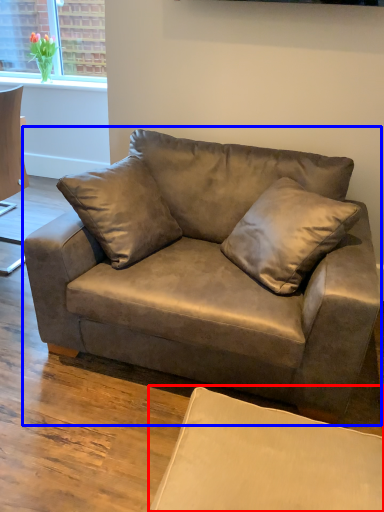
Question: Which object appears closest to the camera in this image, swivel chair (highlighted by a red box) or studio couch (highlighted by a blue box)?

Choices:
 (A) swivel chair
 (B) studio couch

Answer: (A)